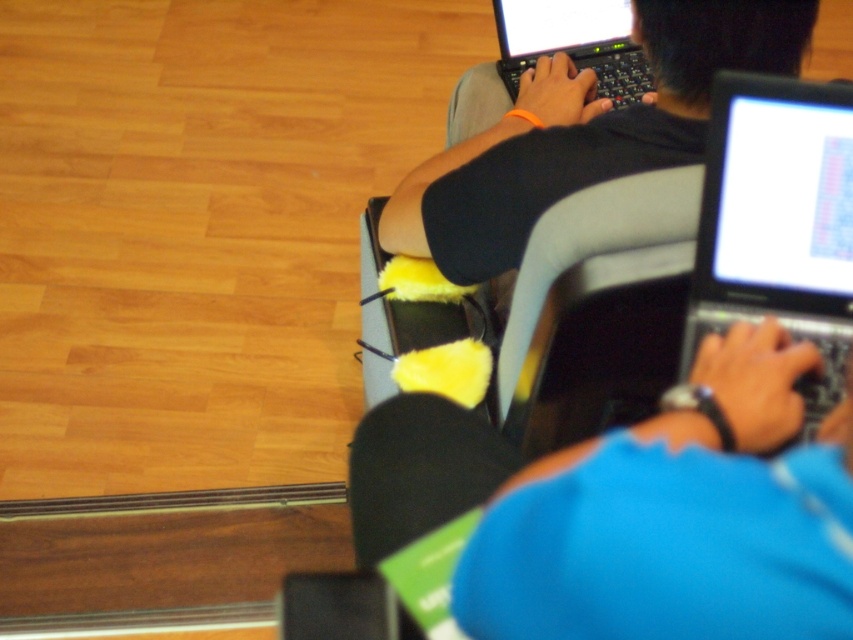
Question: Is the position of black glossy laptop at right more distant than that of black plastic laptop at upper center?

Choices:
 (A) yes
 (B) no

Answer: (B)

Question: Which object is the farthest from the gray fabric armchair at center?

Choices:
 (A) black glossy laptop at right
 (B) black plastic laptop at upper center
 (C) matte black laptop at upper center

Answer: (B)

Question: Can you confirm if matte black laptop at upper center is positioned above black plastic laptop at upper center?

Choices:
 (A) no
 (B) yes

Answer: (A)

Question: Does matte black laptop at upper center lie behind black plastic laptop at upper center?

Choices:
 (A) yes
 (B) no

Answer: (B)

Question: Which point is farther to the camera?

Choices:
 (A) black glossy laptop at right
 (B) black plastic laptop at upper center

Answer: (B)

Question: Which point is closer to the camera?

Choices:
 (A) black plastic laptop at upper center
 (B) matte black laptop at upper center
 (C) black glossy laptop at right

Answer: (C)